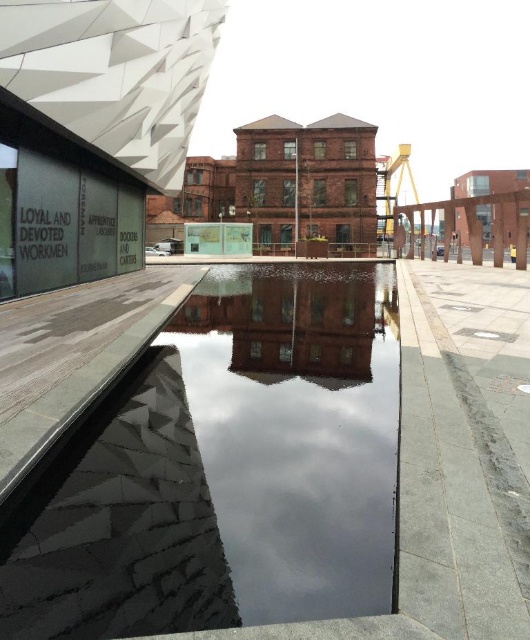
Based on the photo, how far apart are transparent glass water at center and smooth brick building at center?

transparent glass water at center and smooth brick building at center are 1.20 meters apart from each other.

Is transparent glass water at center wider than smooth brick building at center?

No, transparent glass water at center is not wider than smooth brick building at center.

The width and height of the screenshot is (530, 640). What do you see at coordinates (296, 432) in the screenshot?
I see `transparent glass water at center` at bounding box center [296, 432].

Image resolution: width=530 pixels, height=640 pixels. In order to click on transparent glass water at center in this screenshot , I will do `click(296, 432)`.